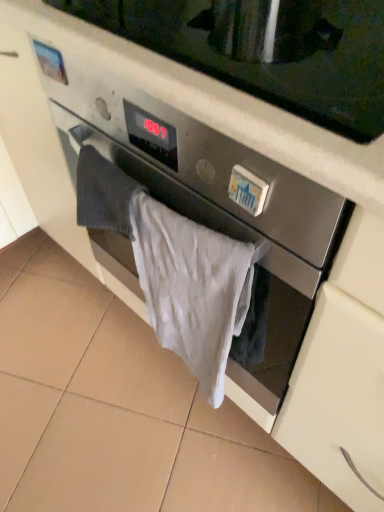
Where is `satin silver microwave at center`? The width and height of the screenshot is (384, 512). satin silver microwave at center is located at coordinates (267, 50).

Describe the element at coordinates (267, 50) in the screenshot. This screenshot has height=512, width=384. I see `satin silver microwave at center` at that location.

Measure the distance between point (209, 9) and camera.

Point (209, 9) is 25.31 inches away from camera.

What do you see at coordinates (191, 288) in the screenshot?
I see `white cotton towel at center` at bounding box center [191, 288].

Looking at this image, in order to face white cotton towel at center, should I rotate leftwards or rightwards?

To align with it, rotate left about 0.104°.

Image resolution: width=384 pixels, height=512 pixels. I want to click on white cotton towel at center, so click(191, 288).

Measure the distance between white cotton towel at center and camera.

white cotton towel at center and camera are 22.03 inches apart from each other.

Where is `satin silver microwave at center`? satin silver microwave at center is located at coordinates (267, 50).

Can you confirm if white cotton towel at center is positioned to the left of satin silver microwave at center?

Indeed, white cotton towel at center is positioned on the left side of satin silver microwave at center.

Does white cotton towel at center come in front of satin silver microwave at center?

That is False.

Considering the points (221, 249) and (188, 27), which point is behind, point (221, 249) or point (188, 27)?

The point (188, 27) is farther.

From the image's perspective, which one is positioned higher, white cotton towel at center or satin silver microwave at center?

satin silver microwave at center appears higher in the image.

From a real-world perspective, does white cotton towel at center sit lower than satin silver microwave at center?

Indeed, from a real-world perspective, white cotton towel at center is positioned beneath satin silver microwave at center.

Which object is thinner, white cotton towel at center or satin silver microwave at center?

white cotton towel at center.

Can you confirm if white cotton towel at center is taller than satin silver microwave at center?

Correct, white cotton towel at center is much taller as satin silver microwave at center.

Which of these two, white cotton towel at center or satin silver microwave at center, is bigger?

Bigger between the two is satin silver microwave at center.

Is white cotton towel at center situated inside satin silver microwave at center or outside?

white cotton towel at center is located beyond the bounds of satin silver microwave at center.

Would you consider white cotton towel at center to be distant from satin silver microwave at center?

Actually, white cotton towel at center and satin silver microwave at center are a little close together.

Could you tell me if white cotton towel at center is turned towards satin silver microwave at center?

No, white cotton towel at center is not turned towards satin silver microwave at center.

Where is `microwave oven located on the right of white cotton towel at center`? The height and width of the screenshot is (512, 384). microwave oven located on the right of white cotton towel at center is located at coordinates (267, 50).

Is satin silver microwave at center at the right side of white cotton towel at center?

Yes, satin silver microwave at center is to the right of white cotton towel at center.

In the image, is satin silver microwave at center positioned in front of or behind white cotton towel at center?

satin silver microwave at center is positioned closer to the viewer than white cotton towel at center.

Between point (289, 61) and point (243, 273), which one is positioned behind?

The point (289, 61) is farther from the camera.

From the image's perspective, does satin silver microwave at center appear lower than white cotton towel at center?

No, from the image's perspective, satin silver microwave at center is not below white cotton towel at center.

From a real-world perspective, is satin silver microwave at center positioned under white cotton towel at center based on gravity?

Incorrect, from a real-world perspective, satin silver microwave at center is higher than white cotton towel at center.

Which object is wider, satin silver microwave at center or white cotton towel at center?

Wider between the two is satin silver microwave at center.

In terms of height, does satin silver microwave at center look taller or shorter compared to white cotton towel at center?

In the image, satin silver microwave at center appears to be shorter than white cotton towel at center.

Is satin silver microwave at center bigger than white cotton towel at center?

Yes.

Do you think satin silver microwave at center is within white cotton towel at center, or outside of it?

satin silver microwave at center is located beyond the bounds of white cotton towel at center.

Is satin silver microwave at center with white cotton towel at center?

There is a gap between satin silver microwave at center and white cotton towel at center.

Is satin silver microwave at center oriented towards white cotton towel at center?

No, satin silver microwave at center is not facing towards white cotton towel at center.

I want to click on microwave oven on the right of white cotton towel at center, so click(x=267, y=50).

Find the location of `microwave oven in front of the white cotton towel at center`. microwave oven in front of the white cotton towel at center is located at coordinates (267, 50).

You are a GUI agent. You are given a task and a screenshot of the screen. Output one action in this format:
    pyautogui.click(x=<x>, y=<y>)
    Task: Click on the bath towel lying on the left of satin silver microwave at center
    This screenshot has height=512, width=384.
    Given the screenshot: What is the action you would take?
    pyautogui.click(x=191, y=288)